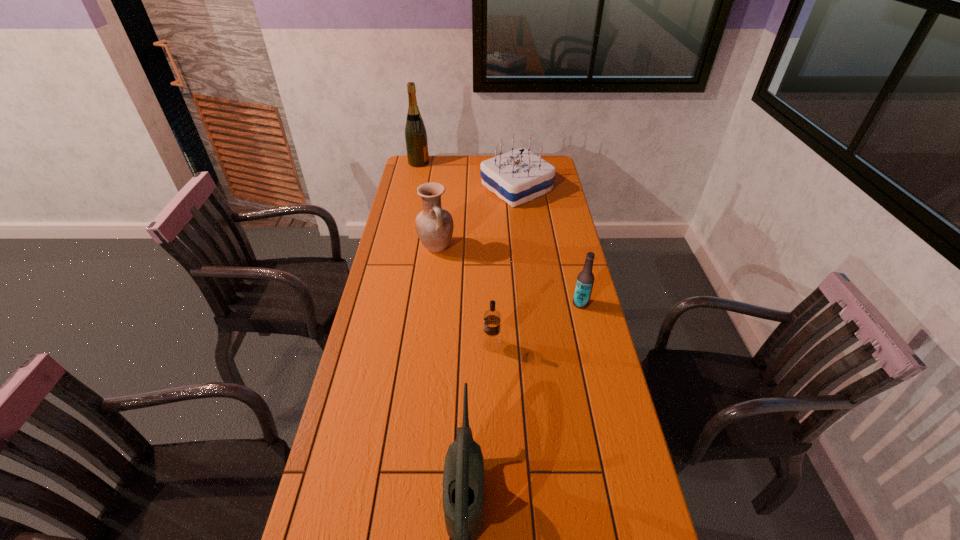
What are the coordinates of `vacant space situated on the side of the beer bottle with the label` in the screenshot? It's located at (517, 303).

Where is `free space located on the side of the beer bottle with the label`? The width and height of the screenshot is (960, 540). free space located on the side of the beer bottle with the label is located at coordinates (546, 303).

You are a GUI agent. You are given a task and a screenshot of the screen. Output one action in this format:
    pyautogui.click(x=<x>, y=<y>)
    Task: Click on the free space located 0.110m on the side of the beer bottle with the label
    The height and width of the screenshot is (540, 960).
    Given the screenshot: What is the action you would take?
    pos(540,303)

Where is `free region located on the label of the second nearest object`? The image size is (960, 540). free region located on the label of the second nearest object is located at coordinates (378, 345).

Locate an element on the screen. The width and height of the screenshot is (960, 540). vacant space located 0.260m on the label of the second nearest object is located at coordinates (400, 345).

Locate an element on the screen. The height and width of the screenshot is (540, 960). free space located 0.390m on the label of the second nearest object is located at coordinates (359, 345).

The height and width of the screenshot is (540, 960). Identify the location of wine bottle present at the far edge. (416, 141).

At what (x,y) coordinates should I click in order to perform the action: click on birthday cake present at the far edge. Please return your answer as a coordinate pair (x, y). The width and height of the screenshot is (960, 540). Looking at the image, I should click on (518, 176).

Identify the location of wine bottle at the left edge. Image resolution: width=960 pixels, height=540 pixels. click(x=416, y=141).

I want to click on pottery at the left edge, so click(x=434, y=225).